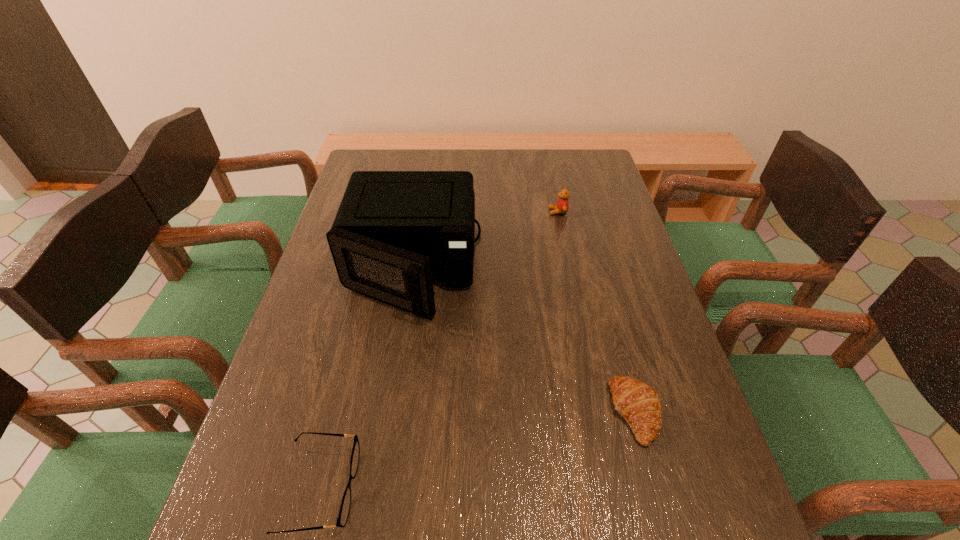
The image size is (960, 540). In order to click on the tallest object in this screenshot , I will do `click(395, 232)`.

Locate an element on the screen. This screenshot has height=540, width=960. the third shortest object is located at coordinates (561, 207).

Image resolution: width=960 pixels, height=540 pixels. I want to click on crescent roll, so click(x=639, y=404).

Locate an element on the screen. vacant space located with the door open on the microwave oven is located at coordinates (363, 492).

You are a GUI agent. You are given a task and a screenshot of the screen. Output one action in this format:
    pyautogui.click(x=<x>, y=<y>)
    Task: Click on the free point located 0.380m on the front-facing side of the teddy bear
    
    Given the screenshot: What is the action you would take?
    pyautogui.click(x=429, y=212)

The image size is (960, 540). What are the coordinates of `free space located on the front-facing side of the teddy bear` in the screenshot? It's located at (448, 212).

Identify the location of vacant space located on the front-facing side of the teddy bear. This screenshot has height=540, width=960. (464, 212).

Identify the location of vacant space situated 0.220m on the left of the crescent roll. This screenshot has width=960, height=540. (506, 412).

This screenshot has width=960, height=540. What are the coordinates of `object situated at the left edge` in the screenshot? It's located at (395, 232).

Find the location of a particular element. This screenshot has width=960, height=540. object that is positioned at the right edge is located at coordinates (639, 404).